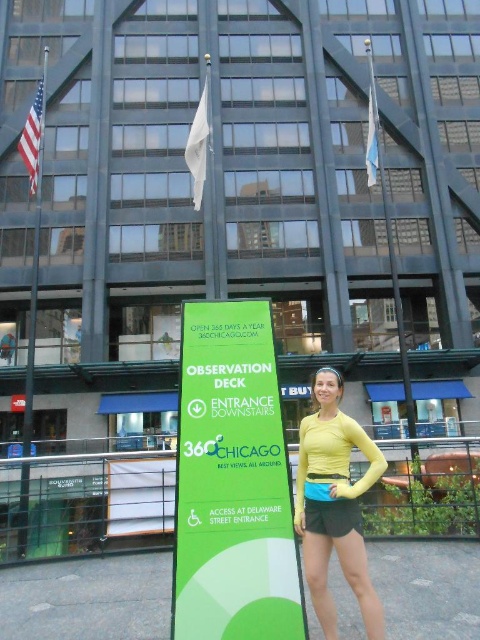
Is the position of green matte sign at center less distant than that of metallic flagpole at left?

Yes, green matte sign at center is closer to the viewer.

At what (x,y) coordinates should I click in order to perform the action: click on green matte sign at center. Please return your answer as a coordinate pair (x, y). This screenshot has height=640, width=480. Looking at the image, I should click on (232, 483).

How far apart are yellow matte long-sleeve shirt at center and metallic flagpole at left?

A distance of 10.21 meters exists between yellow matte long-sleeve shirt at center and metallic flagpole at left.

Is yellow matte long-sleeve shirt at center closer to the viewer compared to metallic flagpole at left?

Yes.

In order to click on yellow matte long-sleeve shirt at center in this screenshot , I will do `click(335, 502)`.

The height and width of the screenshot is (640, 480). I want to click on yellow matte long-sleeve shirt at center, so click(335, 502).

Who is higher up, green matte sign at center or yellow matte long-sleeve shirt at center?

green matte sign at center

Is point (218, 432) closer to viewer compared to point (337, 531)?

No, (218, 432) is behind (337, 531).

Is point (206, 454) behind point (322, 481)?

Yes, point (206, 454) is farther from viewer.

Find the location of a particular element. The height and width of the screenshot is (640, 480). green matte sign at center is located at coordinates (232, 483).